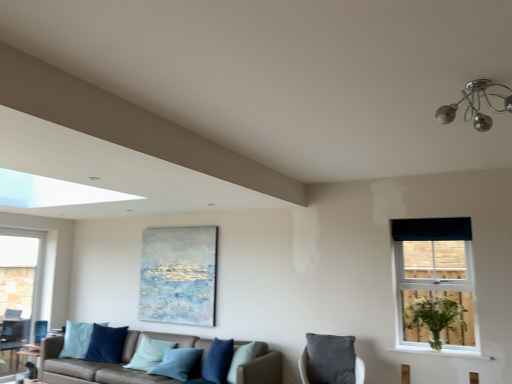
I want to click on leather couch with blue pillows at lower center, so click(x=111, y=364).

Locate an element on the screen. The height and width of the screenshot is (384, 512). velvety gray pillow at lower center, which is the fourth pillow from left to right is located at coordinates (330, 359).

At what (x,y) coordinates should I click in order to perform the action: click on clear glass window at left, the 1th window positioned from the left. Please return your answer as a coordinate pair (x, y). Image resolution: width=512 pixels, height=384 pixels. Looking at the image, I should click on (19, 293).

At what (x,y) coordinates should I click in order to perform the action: click on velvet blue pillow at center, the 2th pillow positioned from the front. Please return your answer as a coordinate pair (x, y). This screenshot has height=384, width=512. Looking at the image, I should click on (218, 361).

The height and width of the screenshot is (384, 512). What do you see at coordinates (440, 352) in the screenshot?
I see `white painted wood at lower right` at bounding box center [440, 352].

What do you see at coordinates (149, 353) in the screenshot?
I see `light blue fabric pillow at center, the third pillow positioned from the front` at bounding box center [149, 353].

Locate an element on the screen. leather couch with blue pillows at lower center is located at coordinates tap(111, 364).

Could you tell me if white painted wood at lower right is turned towards chrome metallic chandelier at upper right?

No, white painted wood at lower right is not aimed at chrome metallic chandelier at upper right.

From a real-world perspective, is white painted wood at lower right beneath chrome metallic chandelier at upper right?

Indeed, from a real-world perspective, white painted wood at lower right is positioned beneath chrome metallic chandelier at upper right.

How much distance is there between white painted wood at lower right and chrome metallic chandelier at upper right?

white painted wood at lower right is 8.02 feet away from chrome metallic chandelier at upper right.

Which object is positioned more to the right, light blue fabric pillow at center, which is counted as the second pillow, starting from the back, or white painted wood at lower right?

Positioned to the right is white painted wood at lower right.

How many degrees apart are the facing directions of light blue fabric pillow at center, acting as the 3th pillow starting from the right, and white painted wood at lower right?

light blue fabric pillow at center, acting as the 3th pillow starting from the right, and white painted wood at lower right are facing 9.92 degrees away from each other.

Does light blue fabric pillow at center, placed as the 2th pillow when sorted from left to right, turn towards white painted wood at lower right?

No, light blue fabric pillow at center, placed as the 2th pillow when sorted from left to right, is not facing towards white painted wood at lower right.

From a real-world perspective, is light blue fabric pillow at center, acting as the 3th pillow starting from the right, positioned over white painted wood at lower right based on gravity?

No, from a real-world perspective, light blue fabric pillow at center, acting as the 3th pillow starting from the right, is not above white painted wood at lower right.

From the image's perspective, is white painted wood at lower right above or below green leafy plant at right?

Clearly, from the image's perspective, white painted wood at lower right is below green leafy plant at right.

Can you confirm if white painted wood at lower right is wider than green leafy plant at right?

In fact, white painted wood at lower right might be narrower than green leafy plant at right.

In the scene shown: In terms of size, does white painted wood at lower right appear bigger or smaller than green leafy plant at right?

white painted wood at lower right is smaller than green leafy plant at right.

From a real-world perspective, is leather couch with blue pillows at lower center positioned above or below chrome metallic chandelier at upper right?

leather couch with blue pillows at lower center is below chrome metallic chandelier at upper right.

Can you confirm if leather couch with blue pillows at lower center is wider than chrome metallic chandelier at upper right?

Indeed, leather couch with blue pillows at lower center has a greater width compared to chrome metallic chandelier at upper right.

Is leather couch with blue pillows at lower center positioned with its back to chrome metallic chandelier at upper right?

No, leather couch with blue pillows at lower center's orientation is not away from chrome metallic chandelier at upper right.

Is point (213, 378) positioned after point (424, 327)?

That is True.

Is velvet blue pillow at center, the 3th pillow in the left-to-right sequence, at the right side of green leafy plant at right?

No.

How different are the orientations of velvet blue pillow at center, the third pillow viewed from the back, and green leafy plant at right in degrees?

They differ by 27.5 degrees in their facing directions.

Where is `the 2nd pillow below the green leafy plant at right (from the image's perspective)`? Image resolution: width=512 pixels, height=384 pixels. the 2nd pillow below the green leafy plant at right (from the image's perspective) is located at coordinates (218, 361).

Is clear glass window at left, the second window positioned from the right, not inside velvety gray pillow at lower center, placed as the fourth pillow when sorted from back to front?

Yes, clear glass window at left, the second window positioned from the right, is located beyond the bounds of velvety gray pillow at lower center, placed as the fourth pillow when sorted from back to front.

Looking at their sizes, would you say clear glass window at left, arranged as the first window when viewed from the back, is wider or thinner than velvety gray pillow at lower center, placed as the 1th pillow when sorted from front to back?

clear glass window at left, arranged as the first window when viewed from the back, is thinner than velvety gray pillow at lower center, placed as the 1th pillow when sorted from front to back.

Between clear glass window at left, the second window positioned from the right, and velvety gray pillow at lower center, placed as the 1th pillow when sorted from front to back, which one has larger size?

A: clear glass window at left, the second window positioned from the right.

Is clear glass window at left, arranged as the first window when viewed from the back, far from velvety gray pillow at lower center, placed as the fourth pillow when sorted from back to front?

Yes, clear glass window at left, arranged as the first window when viewed from the back, is far from velvety gray pillow at lower center, placed as the fourth pillow when sorted from back to front.

Which of these two, green leafy plant at right or velvety gray pillow at lower center, placed as the 1th pillow when sorted from front to back, is wider?

green leafy plant at right is wider.

Looking at this image, from a real-world perspective, which object rests below the other?

velvety gray pillow at lower center, which is the fourth pillow from left to right, is physically lower.

Is green leafy plant at right behind velvety gray pillow at lower center, placed as the 1th pillow when sorted from front to back?

No, green leafy plant at right is closer to the viewer.

How much distance is there between green leafy plant at right and velvety gray pillow at lower center, placed as the 1th pillow when sorted from front to back?

They are 32.79 inches apart.

This screenshot has height=384, width=512. I want to click on light fixture above the white painted wood at lower right (from a real-world perspective), so click(475, 105).

This screenshot has width=512, height=384. I want to click on the 3rd pillow to the left when counting from the white painted wood at lower right, so click(x=149, y=353).

Considering their positions, is white painted wood at lower right positioned further to clear glass window at left, the second window positioned from the right, than leather couch with blue pillows at lower center?

white painted wood at lower right is further to clear glass window at left, the second window positioned from the right.

Which object lies further to the anchor point black fabric curtain at upper right, white painted wood at lower right or velvety gray pillow at lower center, placed as the 1th pillow when sorted from front to back?

velvety gray pillow at lower center, placed as the 1th pillow when sorted from front to back, is positioned further to the anchor black fabric curtain at upper right.

Estimate the real-world distances between objects in this image. Which object is closer to velvet blue pillow at center, the third pillow viewed from the back, black fabric window at upper right, the 1th window viewed from the front, or chrome metallic chandelier at upper right?

Based on the image, black fabric window at upper right, the 1th window viewed from the front, appears to be nearer to velvet blue pillow at center, the third pillow viewed from the back.

Estimate the real-world distances between objects in this image. Which object is closer to white painted wood at lower right, leather couch with blue pillows at lower center or green leafy plant at right?

The object closer to white painted wood at lower right is green leafy plant at right.

From the picture: Which object lies nearer to the anchor point black fabric curtain at upper right, green leafy plant at right or chrome metallic chandelier at upper right?

Among the two, green leafy plant at right is located nearer to black fabric curtain at upper right.

Estimate the real-world distances between objects in this image. Which object is closer to light blue fabric pillow at center, which is counted as the second pillow, starting from the back, velvet blue pillow at center, the third pillow viewed from the back, or green leafy plant at right?

velvet blue pillow at center, the third pillow viewed from the back, lies closer to light blue fabric pillow at center, which is counted as the second pillow, starting from the back, than the other object.

From the image, which object appears to be nearer to blue velvet pillow at lower left, the 1th pillow from the back, light blue fabric pillow at center, the third pillow positioned from the front, or velvety gray pillow at lower center, placed as the fourth pillow when sorted from back to front?

The object closer to blue velvet pillow at lower left, the 1th pillow from the back, is light blue fabric pillow at center, the third pillow positioned from the front.

Consider the image. Based on their spatial positions, is green leafy plant at right or chrome metallic chandelier at upper right further from blue velvet pillow at lower left, marked as the 4th pillow in a front-to-back arrangement?

chrome metallic chandelier at upper right.

Where is `studio couch located between clear glass window at left, placed as the second window when sorted from front to back, and white painted wood at lower right in the left-right direction`? studio couch located between clear glass window at left, placed as the second window when sorted from front to back, and white painted wood at lower right in the left-right direction is located at coordinates (111, 364).

This screenshot has width=512, height=384. I want to click on window sill positioned between chrome metallic chandelier at upper right and velvet blue pillow at center, the 2th pillow positioned from the front, from near to far, so click(x=440, y=352).

At what (x,y) coordinates should I click in order to perform the action: click on plant situated between leather couch with blue pillows at lower center and black fabric curtain at upper right from left to right. Please return your answer as a coordinate pair (x, y). The width and height of the screenshot is (512, 384). Looking at the image, I should click on (436, 319).

The image size is (512, 384). Find the location of `window sill between textured canvas painting at center and black fabric curtain at upper right in the horizontal direction`. window sill between textured canvas painting at center and black fabric curtain at upper right in the horizontal direction is located at coordinates [x=440, y=352].